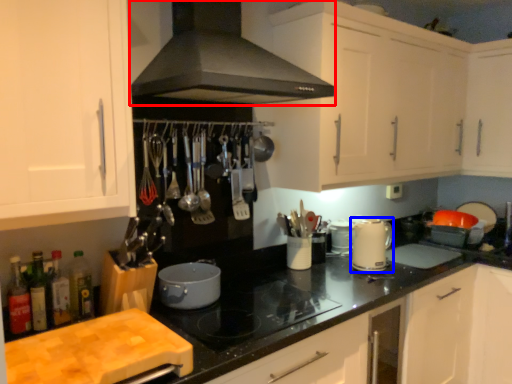
Question: Among these objects, which one is nearest to the camera, home appliance (highlighted by a red box) or kitchen appliance (highlighted by a blue box)?

Choices:
 (A) home appliance
 (B) kitchen appliance

Answer: (A)